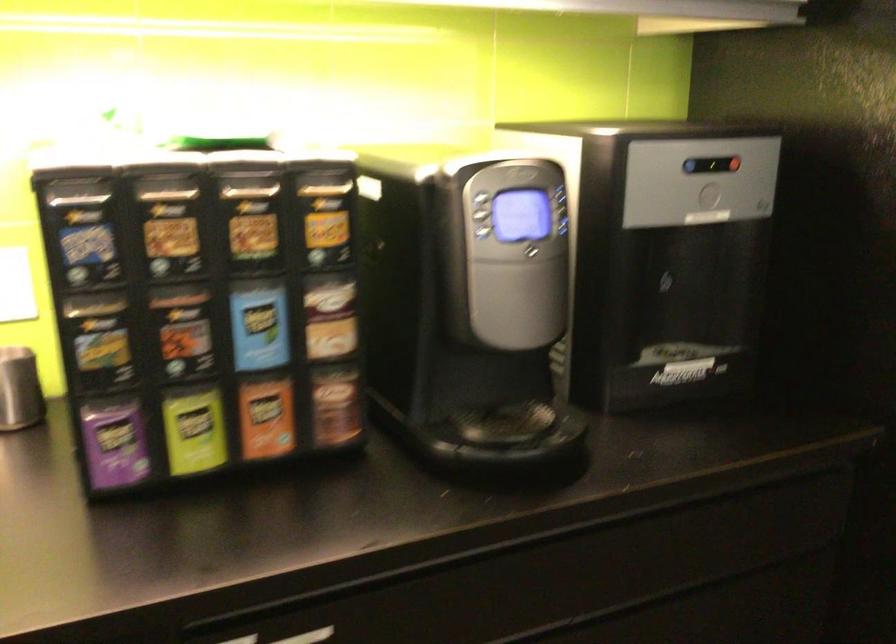
Find the location of a particular element. This screenshot has width=896, height=644. silver cabinet handle is located at coordinates (308, 636).